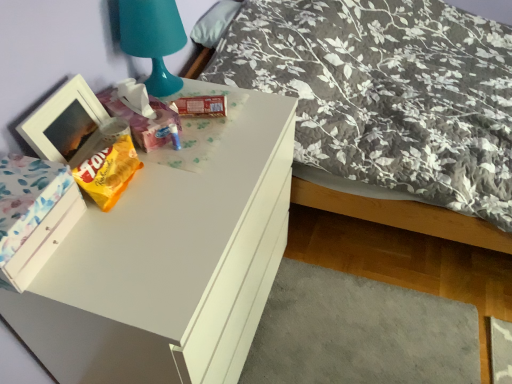
The height and width of the screenshot is (384, 512). What are the coordinates of `free space in front of matte brown package at upper center, the first package positioned from the right` in the screenshot? It's located at (201, 154).